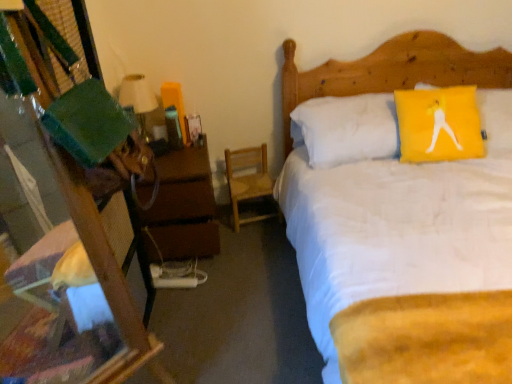
The image size is (512, 384). I want to click on blank space situated above matte white lampshade at left (from a real-world perspective), so click(x=133, y=77).